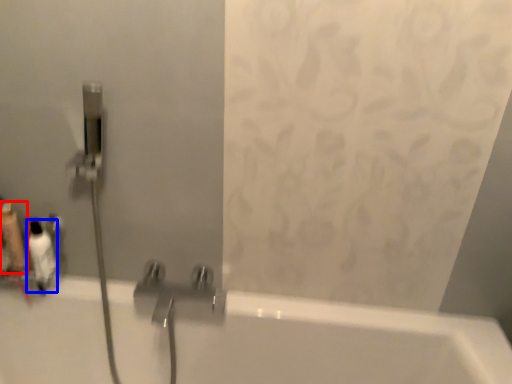
Question: Among these objects, which one is farthest to the camera, toiletry (highlighted by a red box) or toiletry (highlighted by a blue box)?

Choices:
 (A) toiletry
 (B) toiletry

Answer: (A)